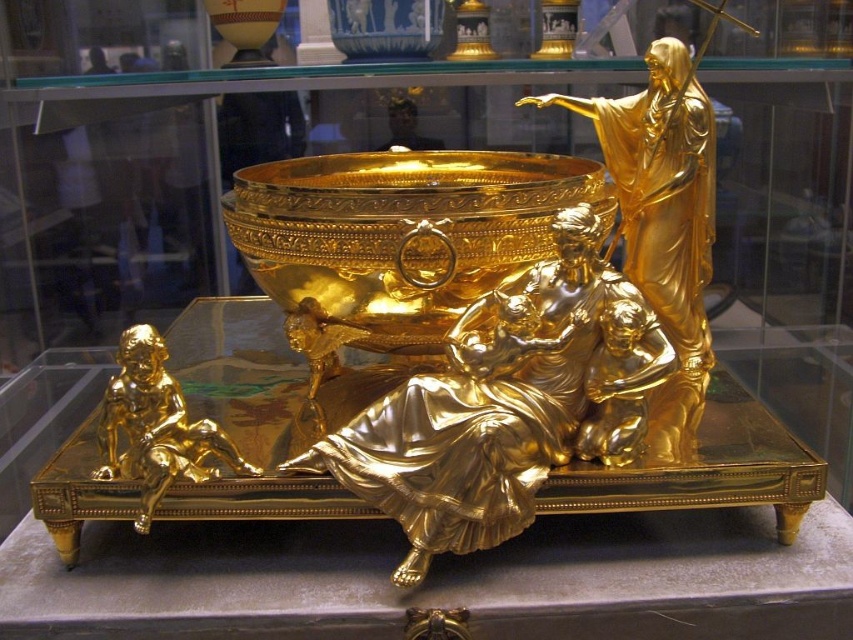
Who is positioned more to the left, gold polished statue at center or gold polished cherub at lower left?

gold polished cherub at lower left is more to the left.

Who is shorter, gold polished statue at center or gold polished cherub at lower left?

gold polished cherub at lower left

Image resolution: width=853 pixels, height=640 pixels. Describe the element at coordinates (506, 403) in the screenshot. I see `gold polished statue at center` at that location.

Where is `gold polished statue at center`? The width and height of the screenshot is (853, 640). gold polished statue at center is located at coordinates (506, 403).